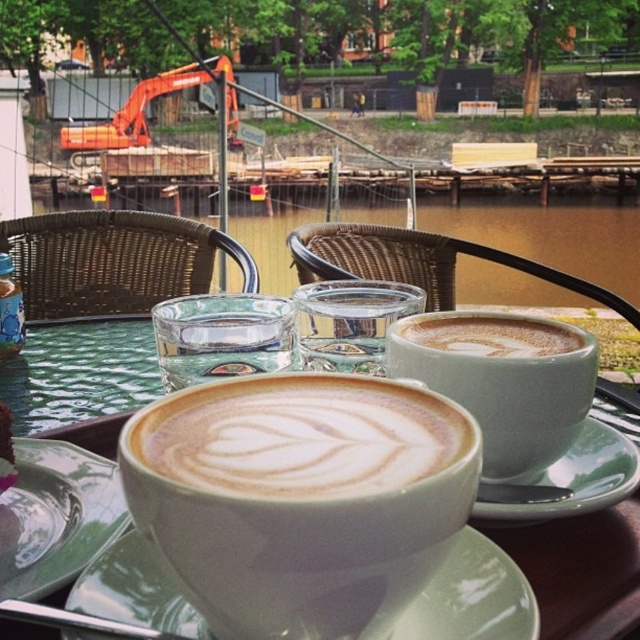
You are a barista trying to place a new cup on the table. The table has limited space between the existing matte ceramic cups at center and the white glossy saucer at center. Based on their sizes, which object should you avoid placing the new cup next to to prevent overcrowding?

The matte ceramic cups at center are wider than the white glossy saucer at center. Therefore, you should avoid placing the new cup next to the matte ceramic cups at center to prevent overcrowding due to their larger width.

You are a barista trying to place a new cup of coffee on the table. The table has a matte ceramic cups at center and a white glossy saucer at center. Where should you place the new cup so it doesn

The matte ceramic cups at center are to the right of the white glossy saucer at center, so placing the new cup to the right of the saucer would align with the existing arrangement.

You are a photographer standing at the camera position. You want to take a closeup shot of the point at coordinate point (195, 529). What is the minimum distance you need to move forward to focus on that point?

The distance between point (195, 529) and the camera is 7.34 inches, so you need to move forward 7.34 inches to focus on that point.